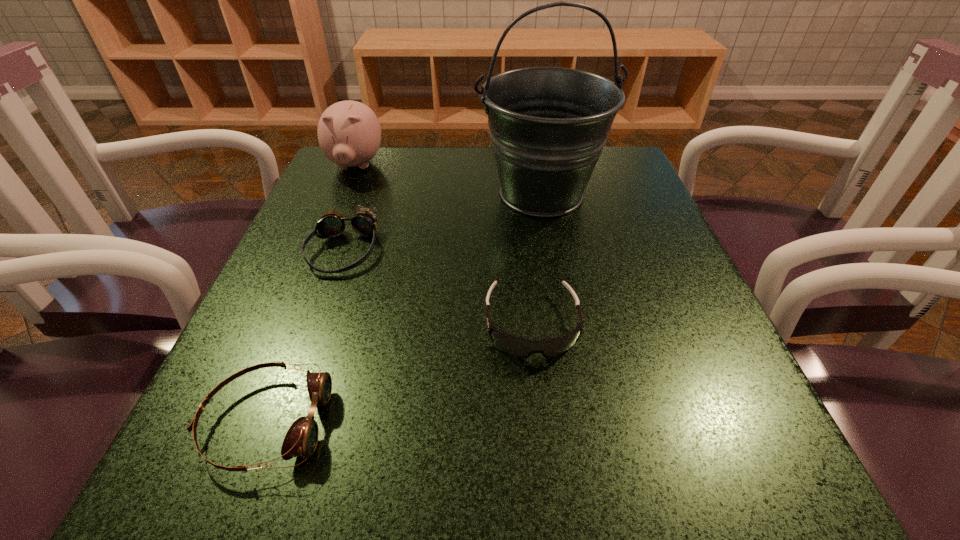
The width and height of the screenshot is (960, 540). In order to click on the tallest object in this screenshot , I will do `click(548, 125)`.

Locate an element on the screen. The height and width of the screenshot is (540, 960). piggy bank is located at coordinates (349, 133).

At what (x,y) coordinates should I click in order to perform the action: click on the farthest goggles. Please return your answer as a coordinate pair (x, y). The height and width of the screenshot is (540, 960). Looking at the image, I should click on (332, 224).

Where is `the second farthest goggles`? The width and height of the screenshot is (960, 540). the second farthest goggles is located at coordinates (522, 347).

Identify the location of the fourth farthest object. Image resolution: width=960 pixels, height=540 pixels. (522, 347).

Locate an element on the screen. the nearest goggles is located at coordinates (301, 439).

The height and width of the screenshot is (540, 960). I want to click on free space located 0.080m on the left of the bucket, so pos(439,194).

Locate an element on the screen. free space located at the snout of the piggy bank is located at coordinates (322, 247).

Where is `vacant region located 0.230m through the lenses of the farthest goggles`? vacant region located 0.230m through the lenses of the farthest goggles is located at coordinates (293, 392).

You are a GUI agent. You are given a task and a screenshot of the screen. Output one action in this format:
    pyautogui.click(x=<x>, y=<y>)
    Task: Click on the vacant space positioned 0.080m on the front and sides of the second nearest goggles
    The image size is (960, 540).
    Given the screenshot: What is the action you would take?
    pyautogui.click(x=541, y=414)